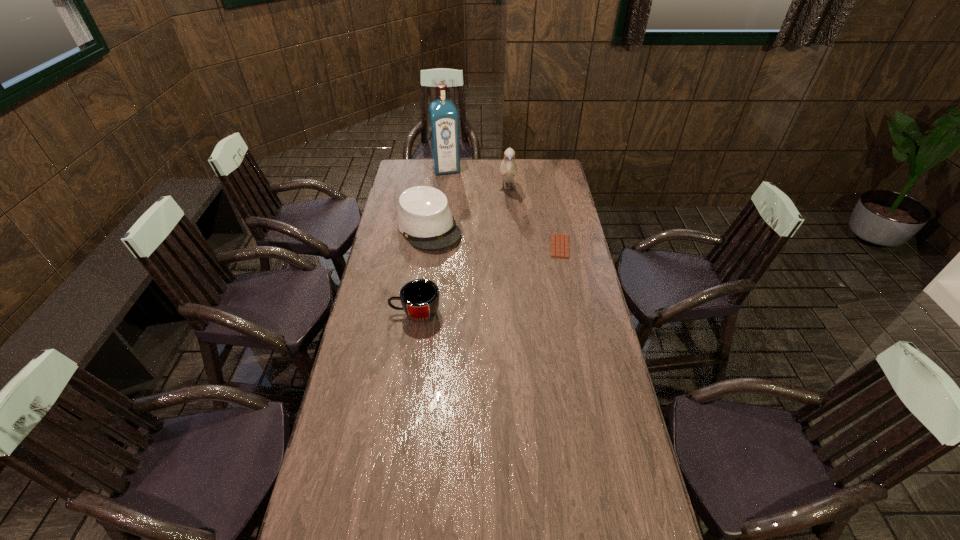
You are a GUI agent. You are given a task and a screenshot of the screen. Output one action in this format:
    pyautogui.click(x=<x>, y=<y>)
    Task: Click on the second shortest object
    
    Given the screenshot: What is the action you would take?
    pyautogui.click(x=420, y=298)

Find the location of a particular element. This screenshot has height=540, width=960. the nearest object is located at coordinates (420, 298).

The height and width of the screenshot is (540, 960). In order to click on the shortest object in this screenshot , I will do `click(559, 242)`.

The image size is (960, 540). In order to click on the rightmost object in this screenshot , I will do `click(559, 242)`.

Where is `the farthest object`? This screenshot has height=540, width=960. the farthest object is located at coordinates 443,116.

You are a GUI agent. You are given a task and a screenshot of the screen. Output one action in this format:
    pyautogui.click(x=<x>, y=<y>)
    Task: Click on the tallest object
    
    Given the screenshot: What is the action you would take?
    pyautogui.click(x=443, y=116)

Locate an element on the screen. This screenshot has width=960, height=540. the fourth nearest object is located at coordinates (508, 169).

Where is `bird`? This screenshot has height=540, width=960. bird is located at coordinates (508, 169).

Identify the location of the third tallest object. (424, 217).

The width and height of the screenshot is (960, 540). What are the coordinates of `vacant area situated on the side of the mug with the handle` in the screenshot? It's located at (372, 313).